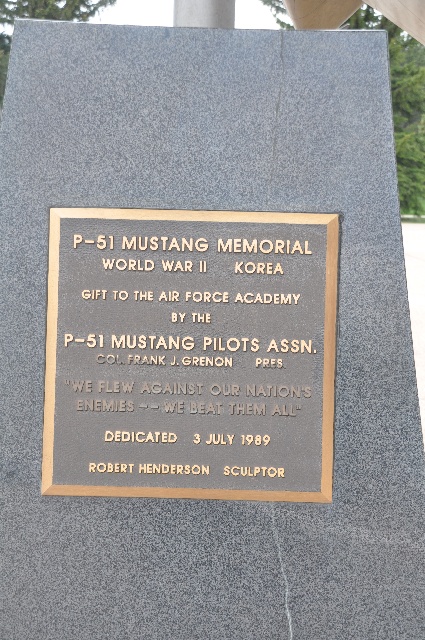
Find the location of a particular element. corner is located at coordinates (15, 18), (387, 31).